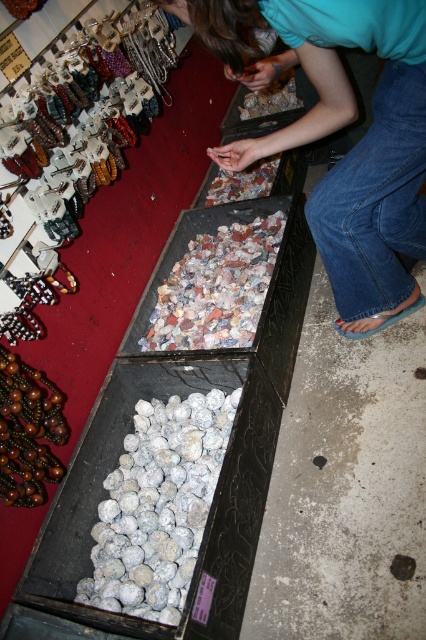
Based on the photo, is wooden beads at left to the left of brown wooden beads at lower left from the viewer's perspective?

In fact, wooden beads at left is to the right of brown wooden beads at lower left.

Is wooden beads at left taller than brown wooden beads at lower left?

Correct, wooden beads at left is much taller as brown wooden beads at lower left.

Consider the image. Who is more distant from viewer, (x=28, y=500) or (x=9, y=500)?

Positioned behind is point (x=28, y=500).

Where is `wooden beads at left`? Image resolution: width=426 pixels, height=640 pixels. wooden beads at left is located at coordinates (69, 150).

Is point (118, 492) less distant than point (62, 419)?

No.

Who is more forward, (100,544) or (25,477)?

Point (25,477) is more forward.

Which is in front, point (135, 504) or point (11, 392)?

Point (11, 392) is more forward.

Identify the location of white matte pebbles at center. This screenshot has height=640, width=426. (158, 506).

Measure the distance between denim jeans at lower right and brown wooden beads at lower left.

A distance of 36.23 inches exists between denim jeans at lower right and brown wooden beads at lower left.

Looking at this image, is denim jeans at lower right shorter than brown wooden beads at lower left?

No.

Which is in front, point (319, 40) or point (19, 451)?

Point (319, 40) is more forward.

Locate an element on the screen. This screenshot has height=640, width=426. denim jeans at lower right is located at coordinates (337, 129).